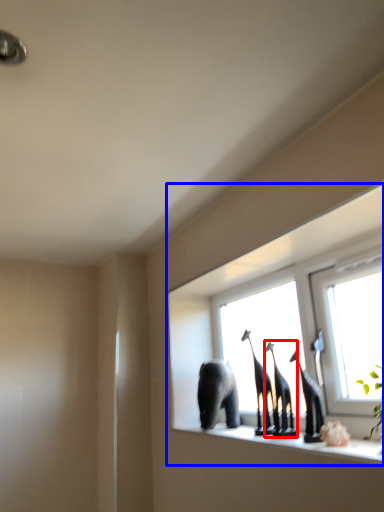
Question: Which point is further to the camera, animal (highlighted by a red box) or window (highlighted by a blue box)?

Choices:
 (A) animal
 (B) window

Answer: (A)